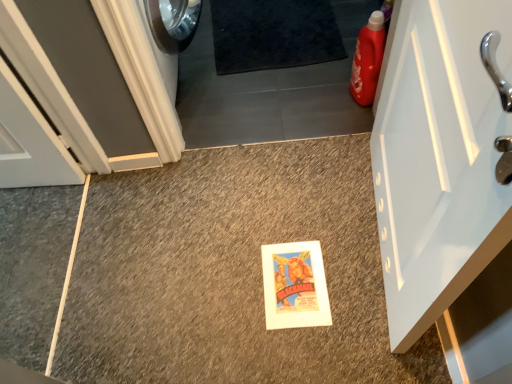
Question: Is black shaggy carpet at upper center next to white painted wood door at left, which is counted as the second door, starting from the right?

Choices:
 (A) no
 (B) yes

Answer: (A)

Question: Is black shaggy carpet at upper center not close to white painted wood door at left, the first door positioned from the left?

Choices:
 (A) yes
 (B) no

Answer: (B)

Question: Can you confirm if black shaggy carpet at upper center is taller than white painted wood door at left, the first door positioned from the left?

Choices:
 (A) no
 (B) yes

Answer: (A)

Question: Does black shaggy carpet at upper center turn towards white painted wood door at left, which is counted as the second door, starting from the right?

Choices:
 (A) yes
 (B) no

Answer: (B)

Question: Does black shaggy carpet at upper center come in front of white painted wood door at left, which is counted as the second door, starting from the right?

Choices:
 (A) no
 (B) yes

Answer: (A)

Question: Considering the positions of point (364, 54) and point (292, 11), is point (364, 54) closer or farther from the camera than point (292, 11)?

Choices:
 (A) farther
 (B) closer

Answer: (B)

Question: Is matte plastic detergent at right wider or thinner than black shaggy carpet at upper center?

Choices:
 (A) wide
 (B) thin

Answer: (B)

Question: From a real-world perspective, is matte plastic detergent at right above or below black shaggy carpet at upper center?

Choices:
 (A) below
 (B) above

Answer: (B)

Question: Is matte plastic detergent at right bigger or smaller than black shaggy carpet at upper center?

Choices:
 (A) small
 (B) big

Answer: (A)

Question: From a real-world perspective, is white glossy door at right, which is counted as the 2th door, starting from the left, positioned above or below black shaggy carpet at upper center?

Choices:
 (A) below
 (B) above

Answer: (B)

Question: Considering the positions of white glossy door at right, which is counted as the 2th door, starting from the left, and black shaggy carpet at upper center in the image, is white glossy door at right, which is counted as the 2th door, starting from the left, wider or thinner than black shaggy carpet at upper center?

Choices:
 (A) thin
 (B) wide

Answer: (A)

Question: From the image's perspective, relative to black shaggy carpet at upper center, is white glossy door at right, which is counted as the 2th door, starting from the left, above or below?

Choices:
 (A) above
 (B) below

Answer: (B)

Question: Relative to black shaggy carpet at upper center, is white glossy door at right, which is counted as the 2th door, starting from the left, in front or behind?

Choices:
 (A) front
 (B) behind

Answer: (A)

Question: From a real-world perspective, is matte plastic detergent at right positioned above or below white glossy door at right, positioned as the 1th door in right-to-left order?

Choices:
 (A) below
 (B) above

Answer: (A)

Question: From their relative heights in the image, would you say matte plastic detergent at right is taller or shorter than white glossy door at right, which is counted as the 2th door, starting from the left?

Choices:
 (A) tall
 (B) short

Answer: (B)